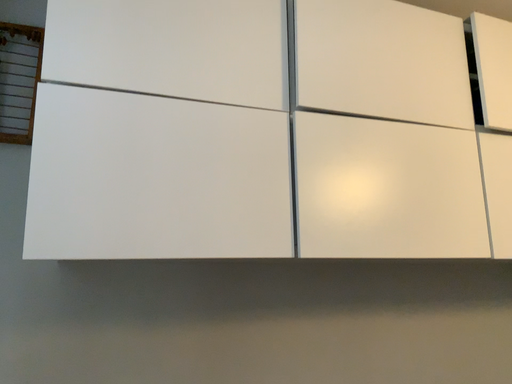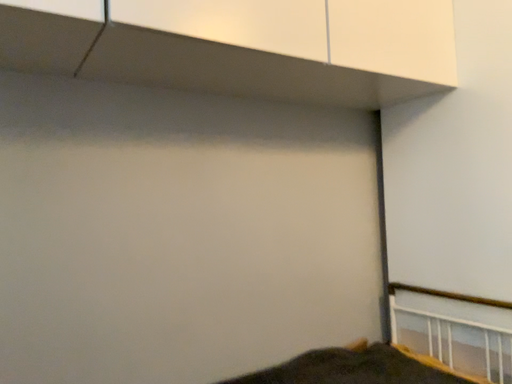
Question: Which way did the camera rotate in the video?

Choices:
 (A) rotated right
 (B) rotated left

Answer: (A)